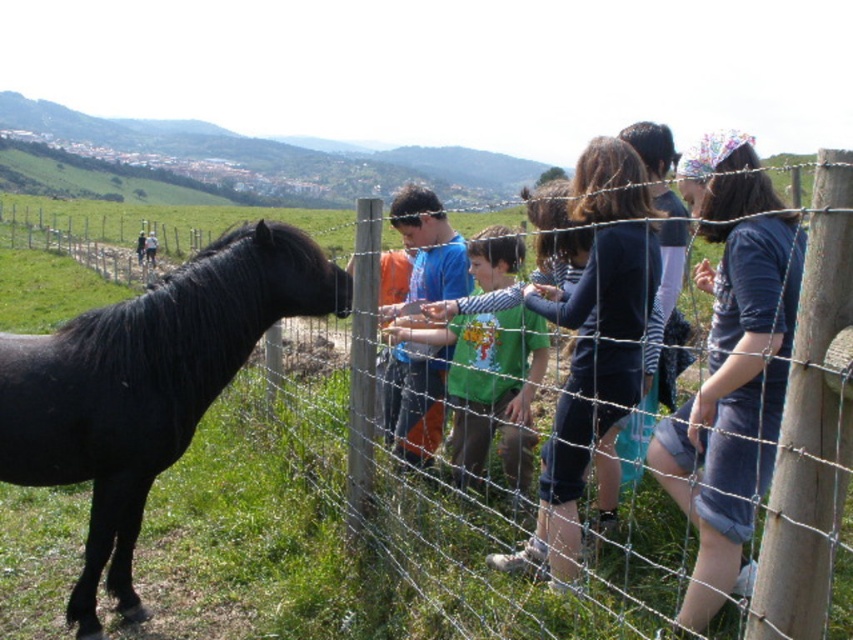
Does green matte shirt at center have a lesser height compared to blue t-shirt at center?

In fact, green matte shirt at center may be taller than blue t-shirt at center.

Is the position of green matte shirt at center less distant than that of blue t-shirt at center?

Yes, green matte shirt at center is in front of blue t-shirt at center.

At what (x,y) coordinates should I click in order to perform the action: click on green matte shirt at center. Please return your answer as a coordinate pair (x, y). This screenshot has width=853, height=640. Looking at the image, I should click on (491, 388).

Where is `green matte shirt at center`? green matte shirt at center is located at coordinates (491, 388).

Who is higher up, orange shirt at center or smooth black pony at left?

orange shirt at center is above.

Is orange shirt at center smaller than smooth black pony at left?

No, orange shirt at center is not smaller than smooth black pony at left.

Find the location of a particular element. The width and height of the screenshot is (853, 640). orange shirt at center is located at coordinates (149, 248).

Image resolution: width=853 pixels, height=640 pixels. What do you see at coordinates (593, 342) in the screenshot?
I see `dark blue jeans at center` at bounding box center [593, 342].

Measure the distance between dark blue jeans at center and camera.

A distance of 8.76 feet exists between dark blue jeans at center and camera.

Locate an element on the screen. This screenshot has height=640, width=853. dark blue jeans at center is located at coordinates (593, 342).